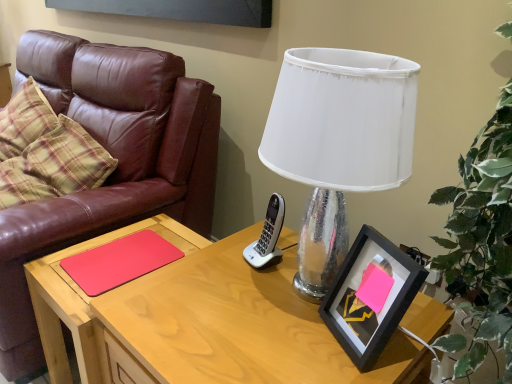
Locate an element on the screen. free space to the left of white fabric lampshade at upper center is located at coordinates (198, 297).